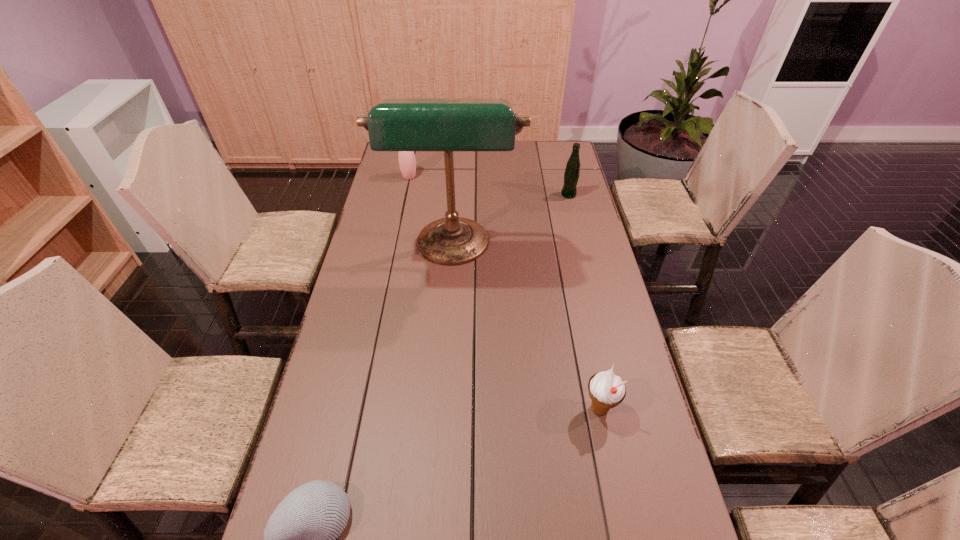
This screenshot has width=960, height=540. What are the coordinates of `table lamp present at the left edge` in the screenshot? It's located at (395, 124).

Image resolution: width=960 pixels, height=540 pixels. I want to click on thermos bottle present at the left edge, so click(407, 162).

I want to click on beer bottle positioned at the right edge, so click(x=572, y=171).

Image resolution: width=960 pixels, height=540 pixels. I want to click on icecream that is at the right edge, so click(606, 390).

Image resolution: width=960 pixels, height=540 pixels. I want to click on free space at the left edge, so click(x=329, y=428).

What are the coordinates of `vacant area at the right edge` in the screenshot? It's located at (558, 272).

Identify the location of vacant area between the second farthest object and the tallest object. The height and width of the screenshot is (540, 960). (511, 222).

I want to click on free spot between the thermos bottle and the beer bottle, so click(489, 186).

Where is `empty space that is in between the beer bottle and the second nearest object`? This screenshot has width=960, height=540. empty space that is in between the beer bottle and the second nearest object is located at coordinates pos(584,302).

What are the coordinates of `object that is the second nearest to the beer bottle` in the screenshot? It's located at pyautogui.click(x=407, y=162).